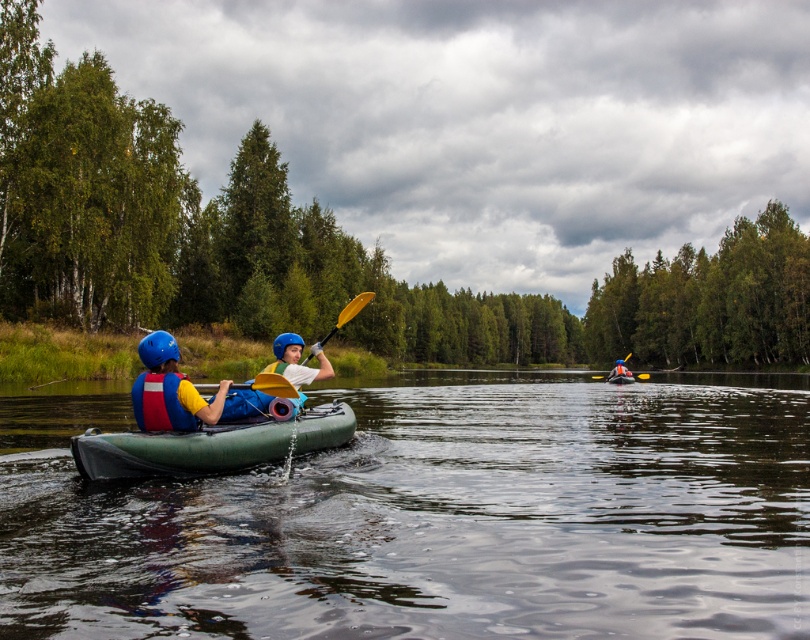
Question: Can you confirm if matte blue helmet at left is positioned below green rubber canoe at center?

Choices:
 (A) yes
 (B) no

Answer: (B)

Question: Does blue helmet at center have a greater width compared to green rubber canoe at center?

Choices:
 (A) yes
 (B) no

Answer: (A)

Question: Which point is farther from the camera taking this photo?

Choices:
 (A) (165, 381)
 (B) (621, 364)
 (C) (169, 465)

Answer: (B)

Question: Which of these objects is positioned farthest from the yellow matte paddle at center?

Choices:
 (A) green rubber canoe at center
 (B) matte blue helmet at center
 (C) matte blue helmet at left
 (D) green rubber kayak at center

Answer: (C)

Question: Which point appears farthest from the camera in this image?

Choices:
 (A) (625, 376)
 (B) (614, 378)

Answer: (A)

Question: Can you confirm if blue fabric life jacket at left is positioned to the right of yellow plastic paddle at center?

Choices:
 (A) no
 (B) yes

Answer: (A)